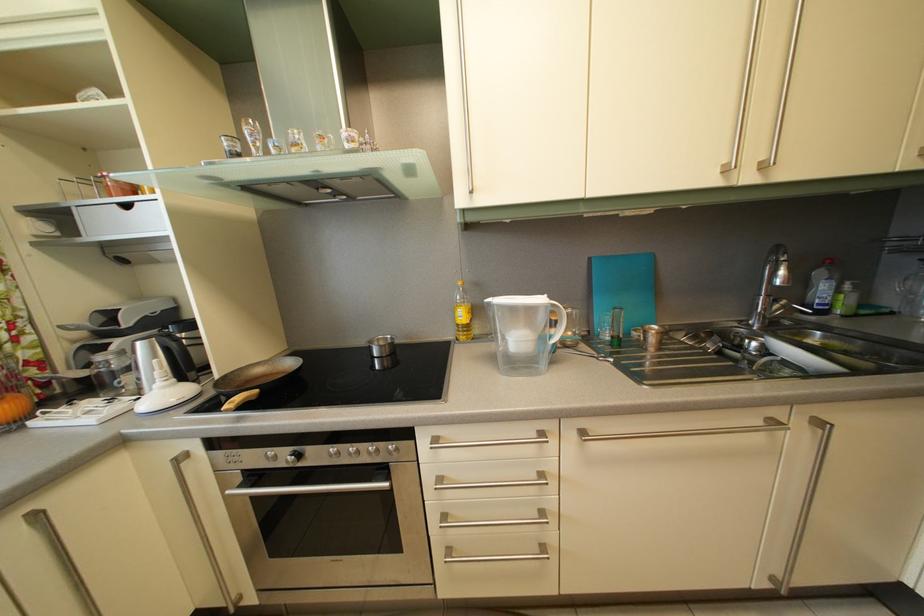
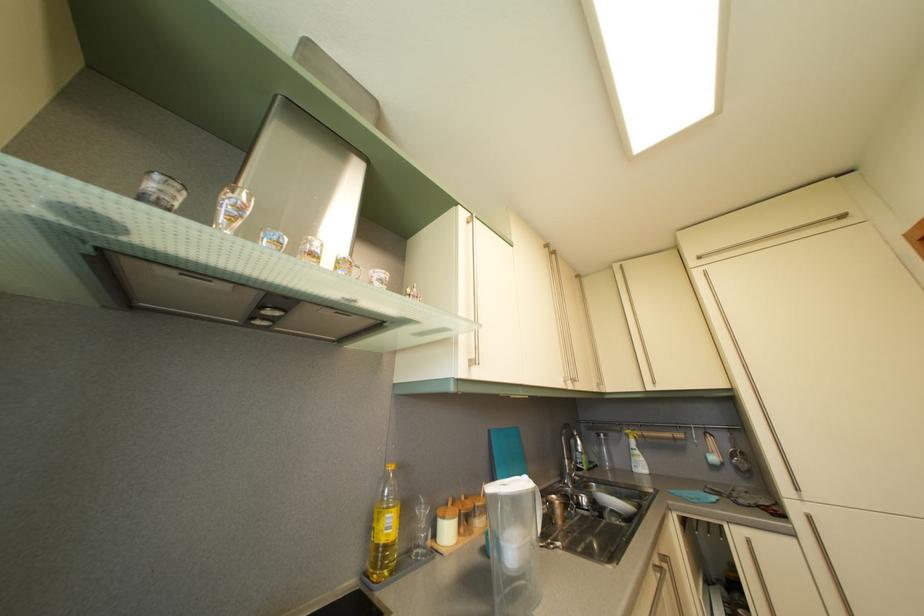
Find the pixel in the second image that matches (x=782, y=363) in the first image.

(613, 516)